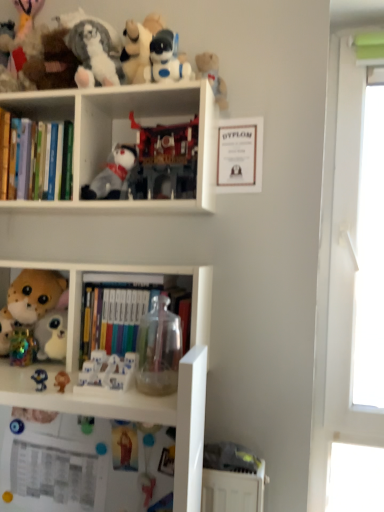
Question: Should I look upward or downward to see white plastic robot at upper center, the second toy positioned from the top?

Choices:
 (A) up
 (B) down

Answer: (A)

Question: From the image's perspective, does white plastic shelf at lower left appear higher than matte blue plush at lower left, which is the third toy in bottom-to-top order?

Choices:
 (A) yes
 (B) no

Answer: (B)

Question: Is white plastic shelf at lower left to the left of matte blue plush at lower left, marked as the ninth toy in a top-to-bottom arrangement, from the viewer's perspective?

Choices:
 (A) yes
 (B) no

Answer: (A)

Question: Does white plastic shelf at lower left have a greater width compared to matte blue plush at lower left, marked as the ninth toy in a top-to-bottom arrangement?

Choices:
 (A) no
 (B) yes

Answer: (B)

Question: From a real-world perspective, is white plastic shelf at lower left beneath matte blue plush at lower left, marked as the ninth toy in a top-to-bottom arrangement?

Choices:
 (A) yes
 (B) no

Answer: (A)

Question: From a real-world perspective, is white plastic shelf at lower left positioned over matte blue plush at lower left, which is the third toy in bottom-to-top order, based on gravity?

Choices:
 (A) yes
 (B) no

Answer: (B)

Question: Is white plastic shelf at lower left beside matte blue plush at lower left, marked as the ninth toy in a top-to-bottom arrangement?

Choices:
 (A) yes
 (B) no

Answer: (B)

Question: Is the depth of hardcover books at center, the 1th book positioned from the right, greater than that of plastic matte robot at center, which is the 9th toy in bottom-to-top order?

Choices:
 (A) no
 (B) yes

Answer: (A)

Question: Does hardcover books at center, the 1th book positioned from the right, come in front of plastic matte robot at center, the third toy when ordered from top to bottom?

Choices:
 (A) yes
 (B) no

Answer: (A)

Question: Can you confirm if hardcover books at center, the second book when ordered from left to right, is wider than plastic matte robot at center, which is the 9th toy in bottom-to-top order?

Choices:
 (A) no
 (B) yes

Answer: (B)

Question: Would you say hardcover books at center, positioned as the second book in top-to-bottom order, contains plastic matte robot at center, the third toy when ordered from top to bottom?

Choices:
 (A) yes
 (B) no

Answer: (B)

Question: Does hardcover books at center, which appears as the 1th book when ordered from the bottom, appear on the left side of plastic matte robot at center, which is the 9th toy in bottom-to-top order?

Choices:
 (A) yes
 (B) no

Answer: (A)

Question: Can you confirm if hardcover books at center, the 1th book positioned from the right, is smaller than plastic matte robot at center, which is the 9th toy in bottom-to-top order?

Choices:
 (A) yes
 (B) no

Answer: (B)

Question: Is fluffy plush toy at left, marked as the 5th toy in a top-to-bottom arrangement, not close to white plastic robot at upper center, the second toy positioned from the top?

Choices:
 (A) no
 (B) yes

Answer: (A)